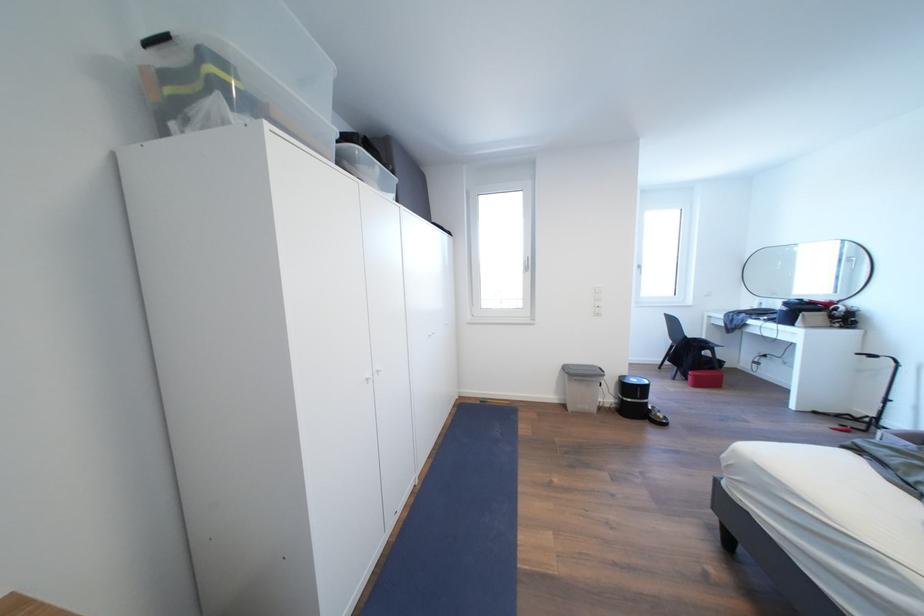
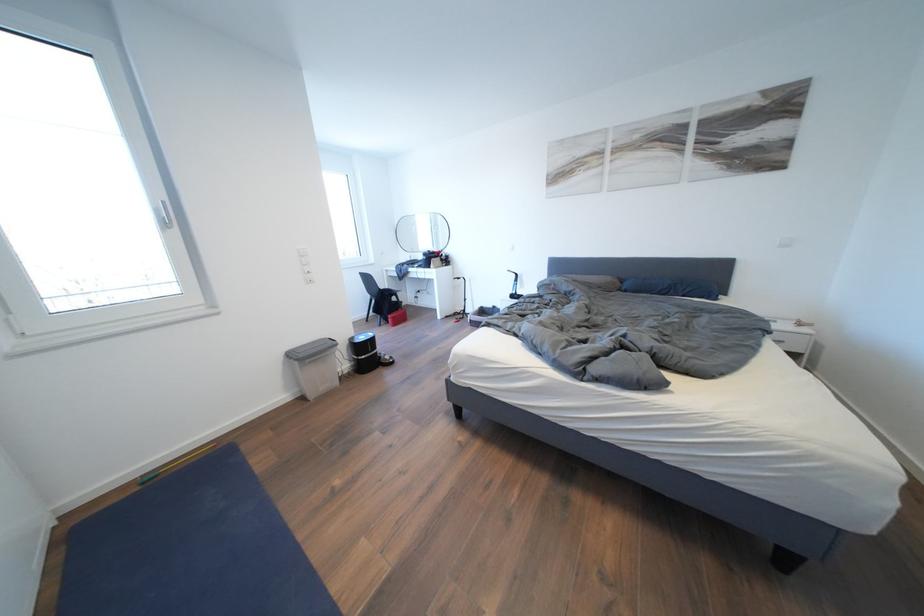
Question: The camera is either moving clockwise (left) or counter-clockwise (right) around the object. The first image is from the beginning of the video and the second image is from the end. Is the camera moving left or right when shooting the video?

Choices:
 (A) Left
 (B) Right

Answer: (A)